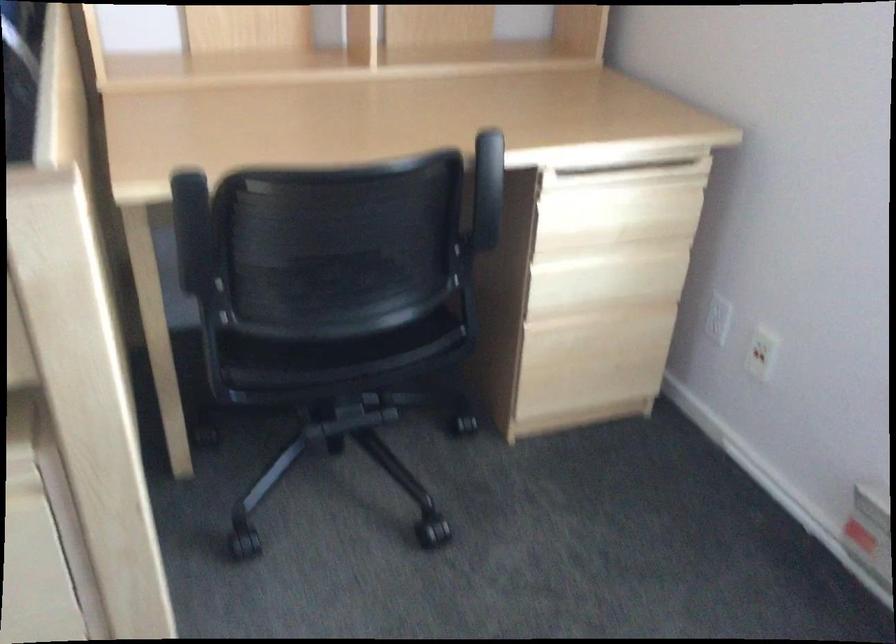
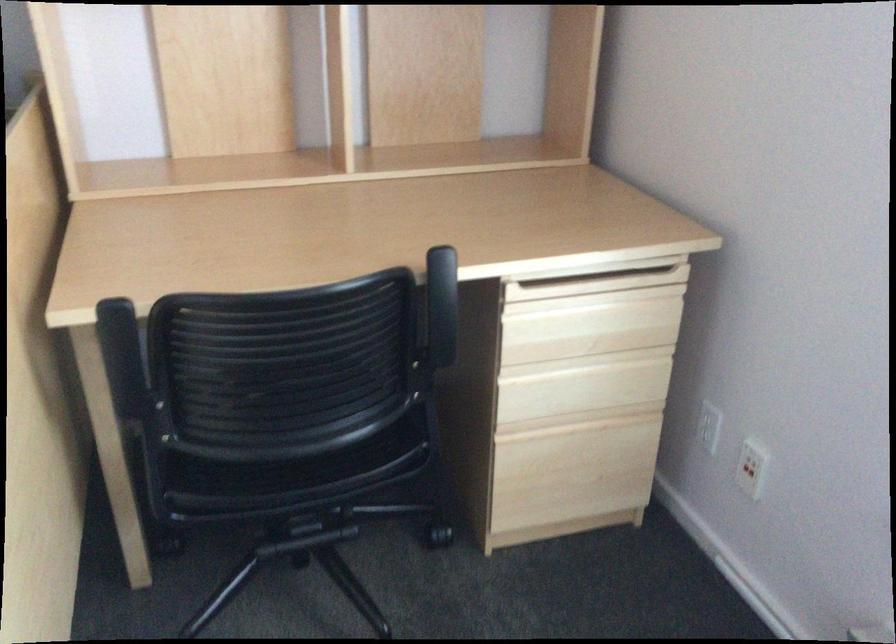
Where in the second image is the point corresponding to point (616, 178) from the first image?

(587, 286)